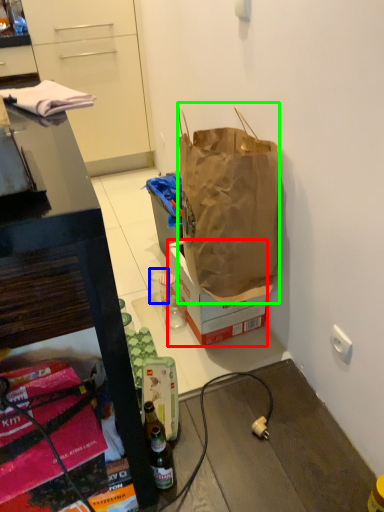
Question: Based on their relative distances, which object is farther from box (highlighted by a red box)? Choose from coffee cup (highlighted by a blue box) and handbag (highlighted by a green box).

Choices:
 (A) coffee cup
 (B) handbag

Answer: (A)